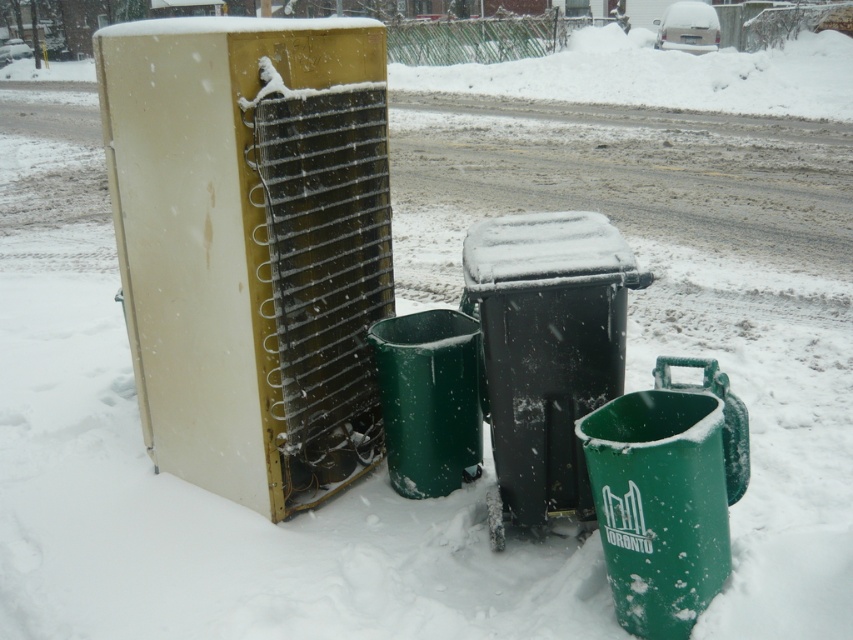
Is black plastic bin at center below green plastic bin at lower right?

Actually, black plastic bin at center is above green plastic bin at lower right.

Can you confirm if black plastic bin at center is taller than green plastic bin at lower right?

Correct, black plastic bin at center is much taller as green plastic bin at lower right.

The height and width of the screenshot is (640, 853). I want to click on black plastic bin at center, so click(x=546, y=349).

Who is lower down, black plastic bin at center or green plastic bin at center?

Positioned lower is green plastic bin at center.

How distant is black plastic bin at center from green plastic bin at center?

black plastic bin at center and green plastic bin at center are 16.17 inches apart.

Is point (543, 275) closer to camera compared to point (428, 365)?

Yes.

This screenshot has height=640, width=853. What are the coordinates of `black plastic bin at center` in the screenshot? It's located at (546, 349).

Can you confirm if green plastic bin at lower right is smaller than green plastic bin at center?

Incorrect, green plastic bin at lower right is not smaller in size than green plastic bin at center.

The width and height of the screenshot is (853, 640). Describe the element at coordinates (666, 493) in the screenshot. I see `green plastic bin at lower right` at that location.

Measure the distance between green plastic bin at lower right and camera.

green plastic bin at lower right is 9.43 feet from camera.

Locate an element on the screen. Image resolution: width=853 pixels, height=640 pixels. green plastic bin at lower right is located at coordinates (666, 493).